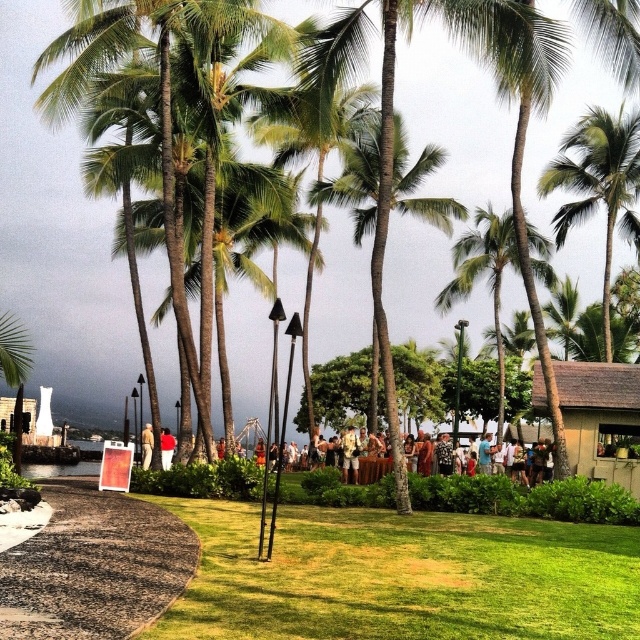
Can you confirm if green leafy palm tree at upper right is positioned below light brown leather jacket at center?

Actually, green leafy palm tree at upper right is above light brown leather jacket at center.

From the picture: Does green leafy palm tree at upper right have a greater width compared to light brown leather jacket at center?

Correct, the width of green leafy palm tree at upper right exceeds that of light brown leather jacket at center.

Is point (611, 116) closer to viewer compared to point (140, 438)?

Yes.

Where is `green leafy palm tree at upper right`? This screenshot has width=640, height=640. green leafy palm tree at upper right is located at coordinates (598, 186).

Who is more forward, (579, 196) or (163, 442)?

Point (163, 442)

I want to click on green leafy palm tree at upper right, so click(598, 186).

Who is lower down, green leafy palm tree at center or light brown leather jacket at center?

light brown leather jacket at center

Is green leafy palm tree at center above light brown leather jacket at center?

Yes, green leafy palm tree at center is above light brown leather jacket at center.

Does point (474, 228) lie behind point (147, 451)?

Yes.

Locate an element on the screen. green leafy palm tree at center is located at coordinates (483, 275).